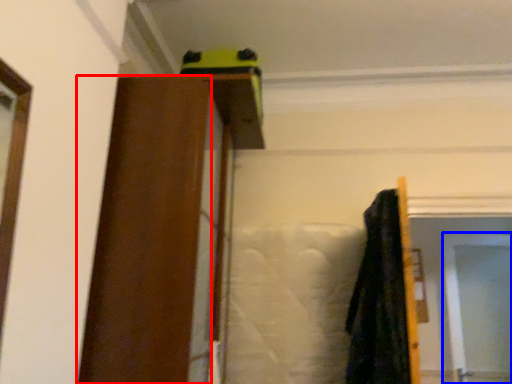
Question: Which object is further to the camera taking this photo, barn door (highlighted by a red box) or screen door (highlighted by a blue box)?

Choices:
 (A) barn door
 (B) screen door

Answer: (B)